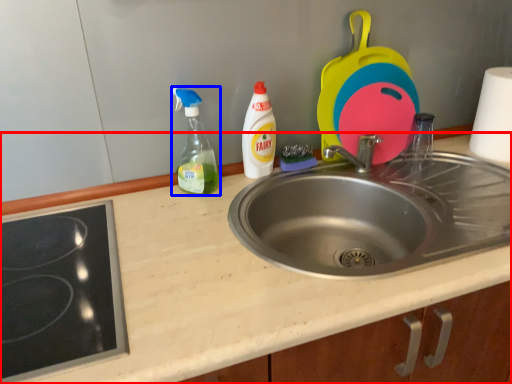
Question: Among these objects, which one is farthest to the camera, counter top (highlighted by a red box) or bottle (highlighted by a blue box)?

Choices:
 (A) counter top
 (B) bottle

Answer: (B)